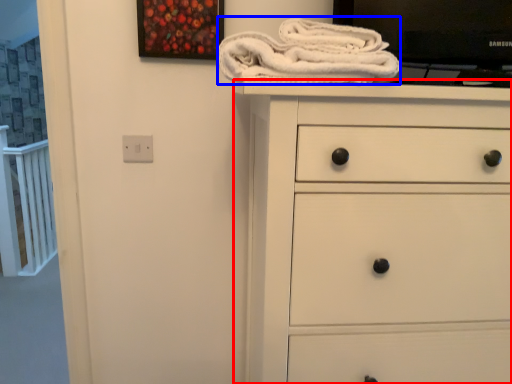
Question: Among these objects, which one is farthest to the camera, chest of drawers (highlighted by a red box) or bath towel (highlighted by a blue box)?

Choices:
 (A) chest of drawers
 (B) bath towel

Answer: (B)